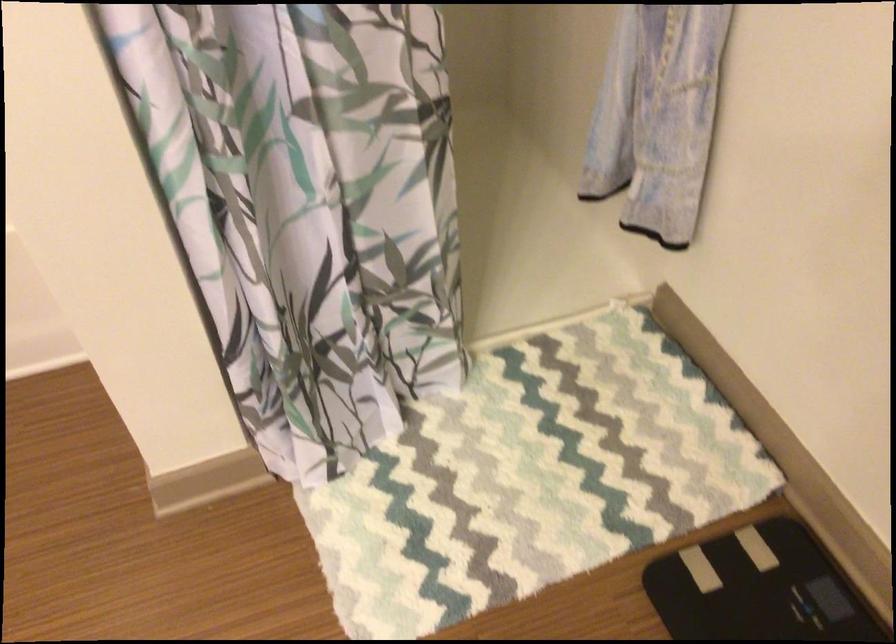
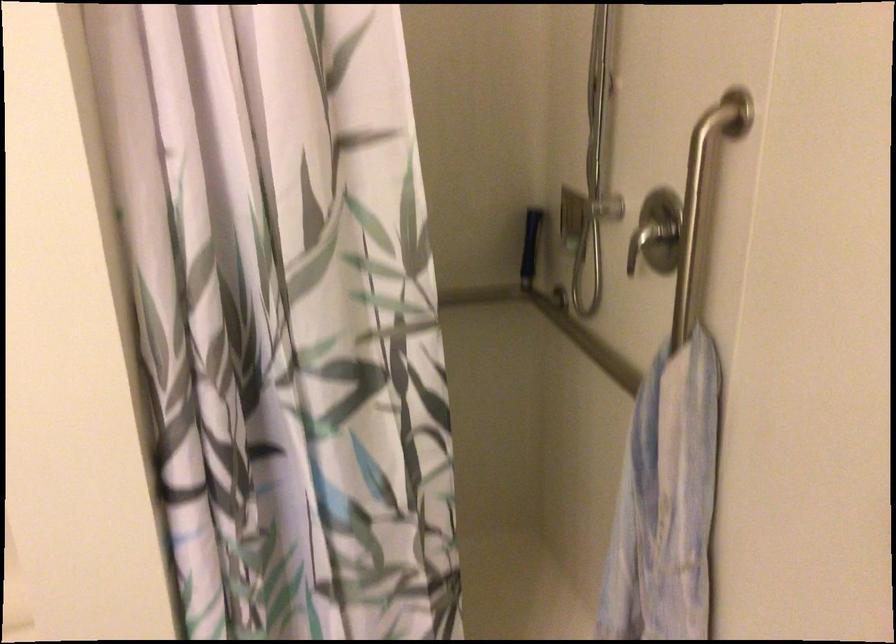
Which direction would the cameraman need to move to produce the second image?

The cameraman moved toward right, backward.